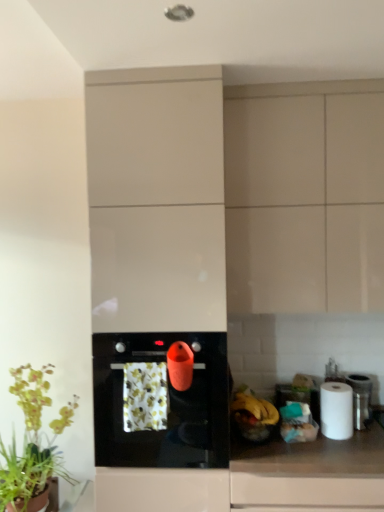
Question: Based on their sizes in the image, would you say white glossy countertop at lower right is bigger or smaller than floral-patterned fabric at center?

Choices:
 (A) small
 (B) big

Answer: (B)

Question: In terms of height, does white glossy countertop at lower right look taller or shorter compared to floral-patterned fabric at center?

Choices:
 (A) tall
 (B) short

Answer: (A)

Question: Estimate the real-world distances between objects in this image. Which object is farther from the metallic silver canister at right?

Choices:
 (A) yellow matte banana at right, which is counted as the first banana, starting from the right
 (B) white glossy cabinet at center, acting as the 1th cabinetry starting from the left
 (C) matte beige cabinet at upper right, the first cabinetry when ordered from right to left
 (D) floral-patterned fabric at center
 (E) white matte paper towel at right

Answer: (B)

Question: Which object is the farthest from the black glossy oven at center?

Choices:
 (A) yellow matte banana at right, which is counted as the first banana, starting from the right
 (B) white matte paper towel at right
 (C) matte beige cabinet at upper right, the first cabinetry when ordered from right to left
 (D) white glossy cabinet at center, acting as the 1th cabinetry starting from the left
 (E) green leafy plant at lower left

Answer: (B)